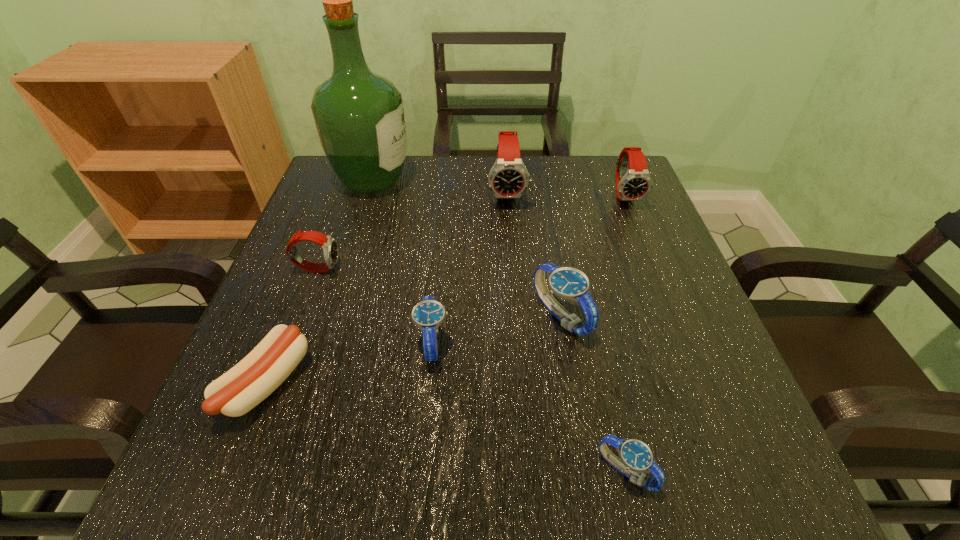
You are a GUI agent. You are given a task and a screenshot of the screen. Output one action in this format:
    pyautogui.click(x=<x>, y=<y>)
    Task: Click on the free space located 0.130m on the back of the sausage
    The image size is (960, 540).
    Given the screenshot: What is the action you would take?
    [x=303, y=288]

Where is `vacant space located on the left of the shortest watch`? The height and width of the screenshot is (540, 960). vacant space located on the left of the shortest watch is located at coordinates (461, 471).

The height and width of the screenshot is (540, 960). Find the location of `liquor located at the far edge`. liquor located at the far edge is located at coordinates (359, 116).

This screenshot has height=540, width=960. What are the coordinates of `object at the near edge` in the screenshot? It's located at (636, 457).

Find the location of a particular element. This screenshot has width=960, height=540. liquor that is at the left edge is located at coordinates (359, 116).

Locate an element on the screen. Image resolution: width=960 pixels, height=540 pixels. watch at the left edge is located at coordinates (330, 248).

You are a GUI agent. You are given a task and a screenshot of the screen. Output one action in this format:
    pyautogui.click(x=<x>, y=<y>)
    Task: Click on the sausage present at the left edge
    
    Given the screenshot: What is the action you would take?
    pyautogui.click(x=236, y=392)

Locate an element on the screen. This screenshot has height=540, width=960. object that is at the far left corner is located at coordinates (359, 116).

Locate an element on the screen. object present at the far right corner is located at coordinates (633, 182).

This screenshot has width=960, height=540. Find the location of `object that is at the near right corner`. object that is at the near right corner is located at coordinates (636, 457).